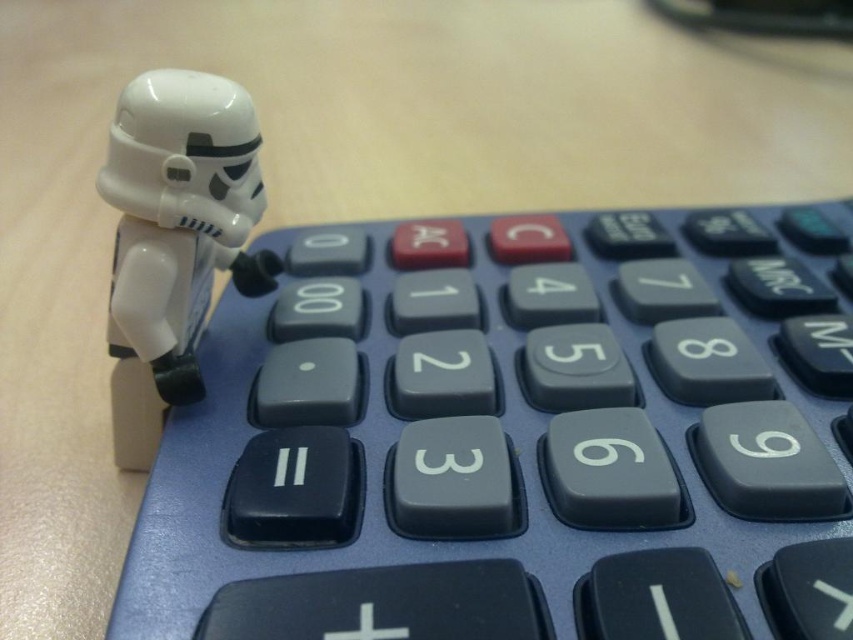
Who is more forward, (728, 284) or (136, 208)?

Point (136, 208) is more forward.

Does point (389, 436) lie behind point (177, 86)?

Yes, point (389, 436) is behind point (177, 86).

I want to click on blue plastic calculator at upper left, so tap(515, 435).